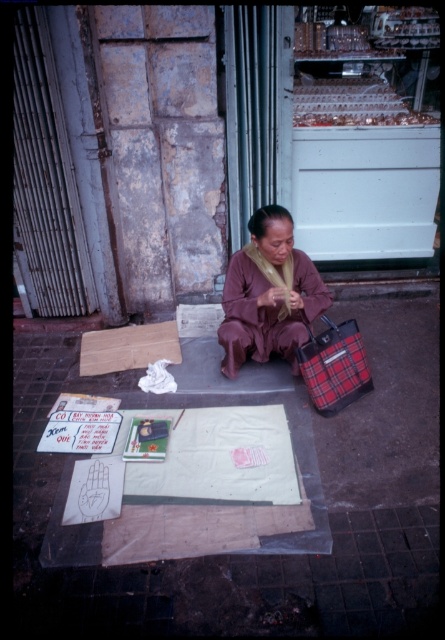
Question: Which point appears closest to the camera in this image?

Choices:
 (A) (290, 332)
 (B) (105, 614)

Answer: (B)

Question: Is the position of smooth concrete surface at center less distant than that of brown matte robe at center?

Choices:
 (A) yes
 (B) no

Answer: (A)

Question: Is smooth concrete surface at center wider than brown matte robe at center?

Choices:
 (A) yes
 (B) no

Answer: (A)

Question: Which of the following is the farthest from the observer?

Choices:
 (A) smooth concrete surface at center
 (B) brown matte robe at center

Answer: (B)

Question: Does smooth concrete surface at center have a greater width compared to brown matte robe at center?

Choices:
 (A) yes
 (B) no

Answer: (A)